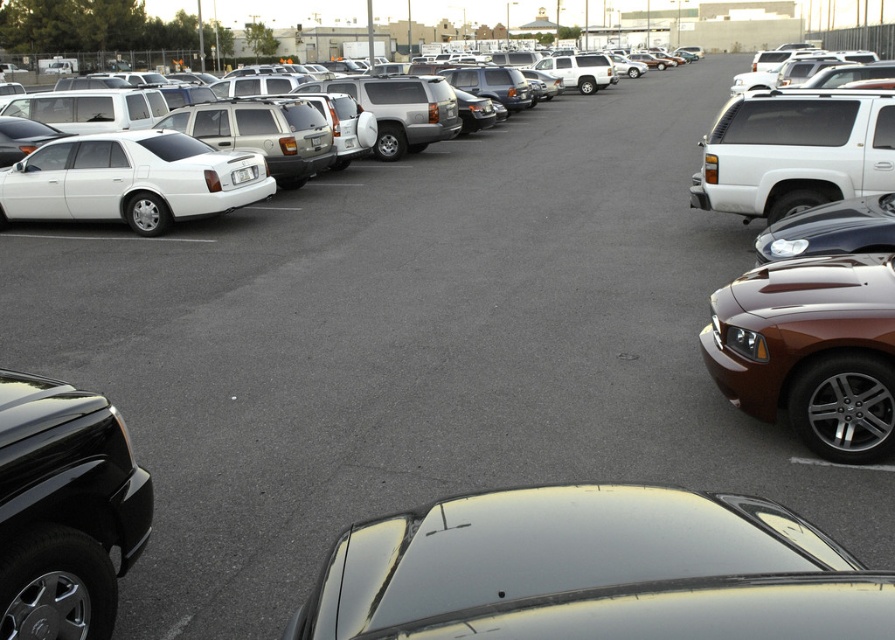
Based on the photo, is glossy black car at center smaller than matte white sedan at left?

Correct, glossy black car at center occupies less space than matte white sedan at left.

Image resolution: width=895 pixels, height=640 pixels. Describe the element at coordinates (589, 568) in the screenshot. I see `glossy black car at center` at that location.

Which is behind, point (833, 561) or point (164, 225)?

The point (164, 225) is behind.

Find the location of a particular element. The image size is (895, 640). glossy black car at center is located at coordinates (589, 568).

The image size is (895, 640). I want to click on glossy black car at center, so click(589, 568).

Can you confirm if glossy black car at center is smaller than white matte suv at right?

Indeed, glossy black car at center has a smaller size compared to white matte suv at right.

Locate an element on the screen. The height and width of the screenshot is (640, 895). glossy black car at center is located at coordinates (589, 568).

Does white matte suv at right appear on the right side of matte white sedan at left?

Yes, white matte suv at right is to the right of matte white sedan at left.

Is white matte suv at right closer to camera compared to matte white sedan at left?

Yes, it is in front of matte white sedan at left.

Locate an element on the screen. white matte suv at right is located at coordinates (795, 150).